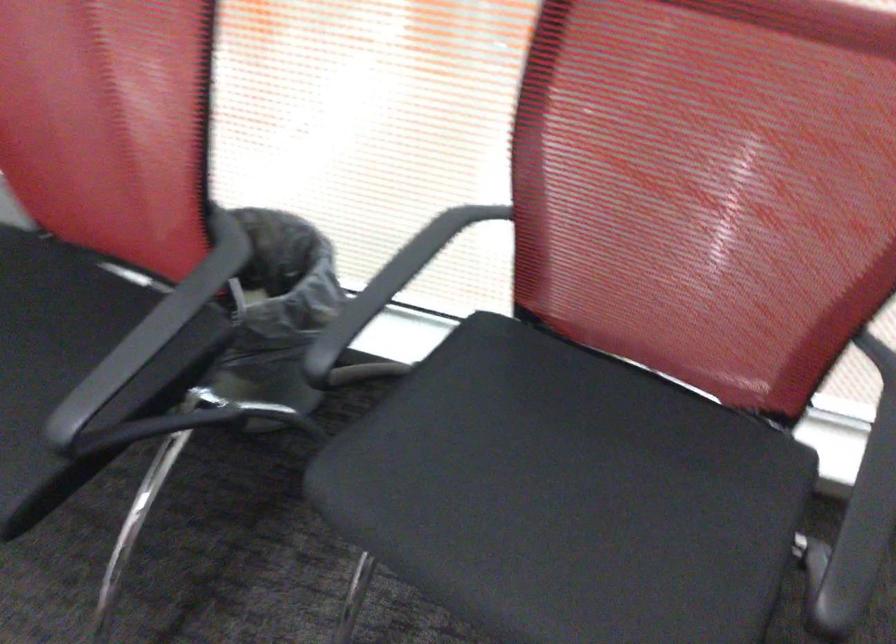
How did the camera likely rotate?

The camera's rotation is toward right-down.